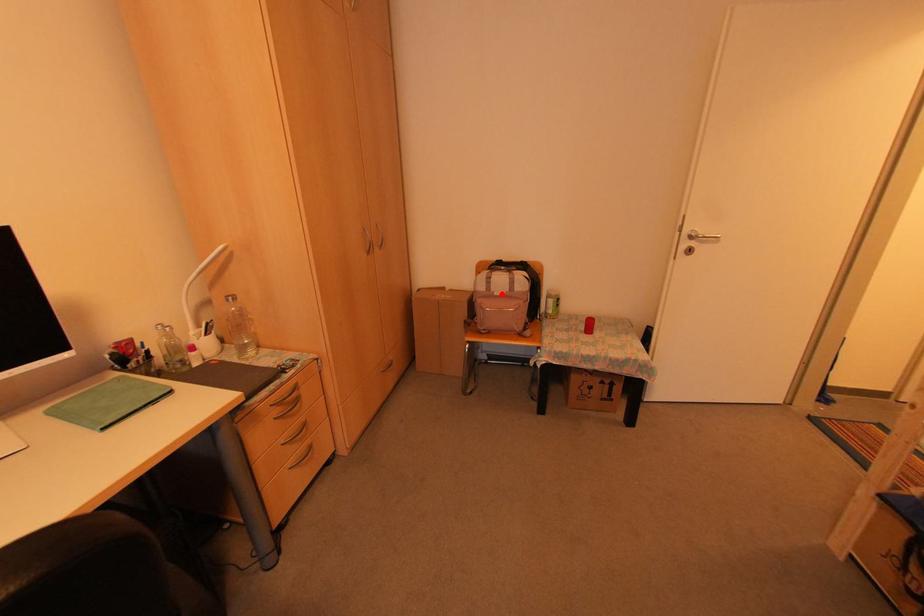
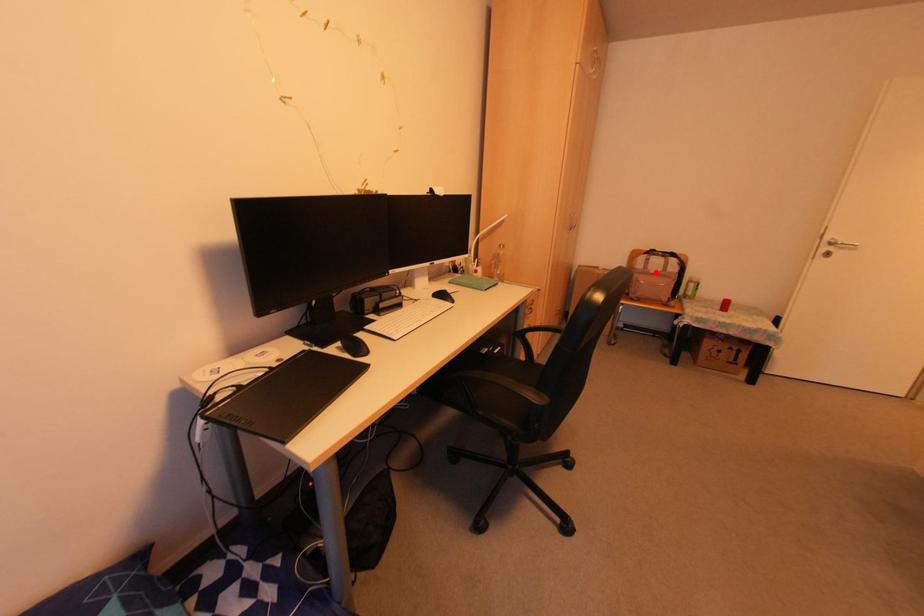
I am providing you with two images of the same scene from different viewpoints. A red point is marked on the first image and another point is marked on the second image. Is the marked point in image1 the same physical position as the marked point in image2?

Yes